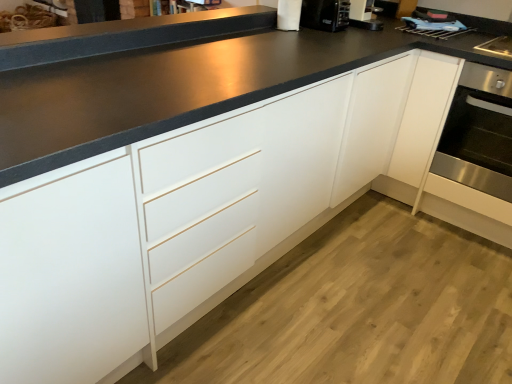
Question: Is white paper towel at upper center inside the boundaries of stainless steel oven at right, or outside?

Choices:
 (A) outside
 (B) inside

Answer: (A)

Question: From the image's perspective, is white paper towel at upper center located above or below stainless steel oven at right?

Choices:
 (A) below
 (B) above

Answer: (B)

Question: Based on their relative distances, which object is farther from the black plastic coffee machine at upper right?

Choices:
 (A) stainless steel oven at right
 (B) black matte countertop at upper center
 (C) white paper towel at upper center

Answer: (A)

Question: Estimate the real-world distances between objects in this image. Which object is farther from the black matte countertop at upper center?

Choices:
 (A) black plastic coffee machine at upper right
 (B) stainless steel oven at right
 (C) white paper towel at upper center

Answer: (B)